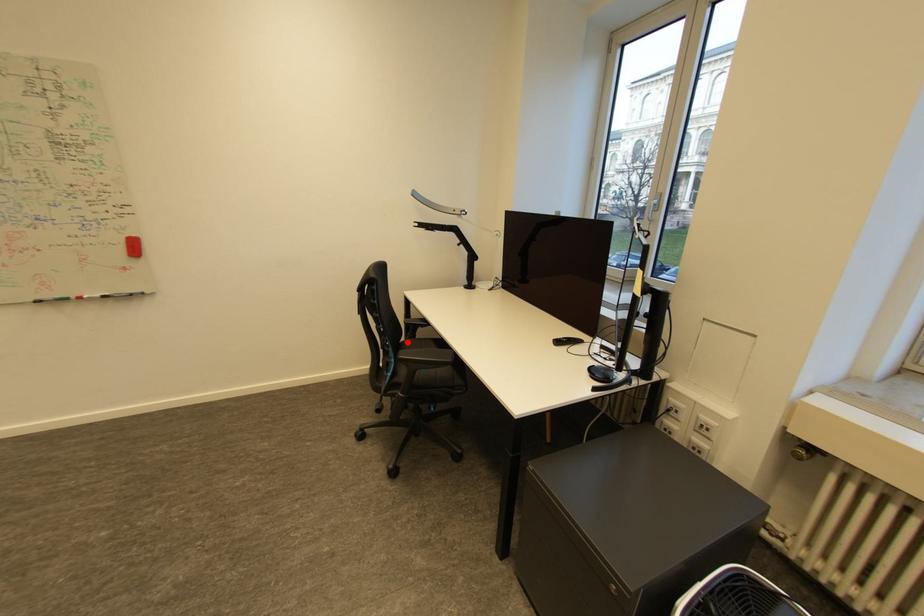
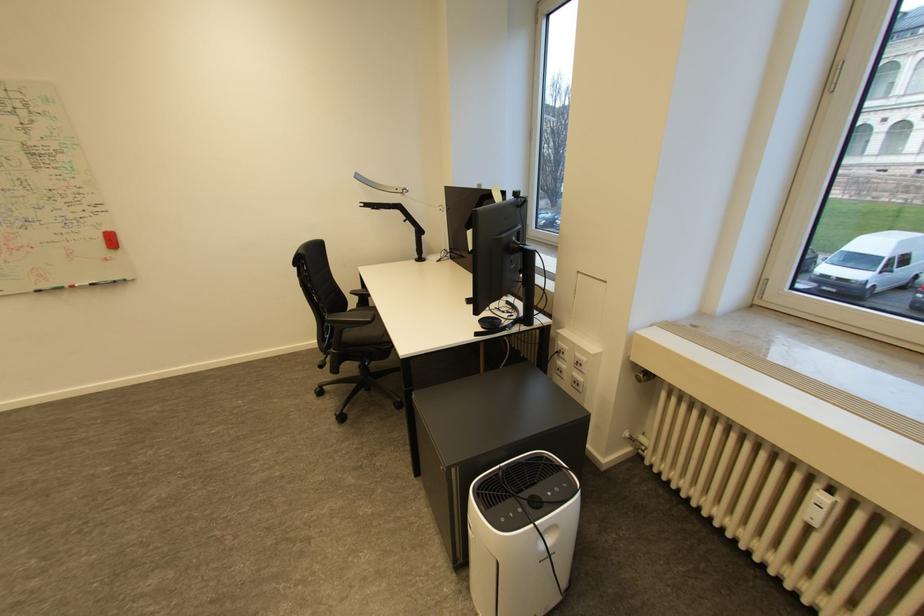
Question: I am providing you with two images of the same scene from different viewpoints. Image1 has a red point marked. In image2, the corresponding 3D location appears at what relative position? Reply with the corresponding letter.

Choices:
 (A) Closer
 (B) Farther

Answer: (A)